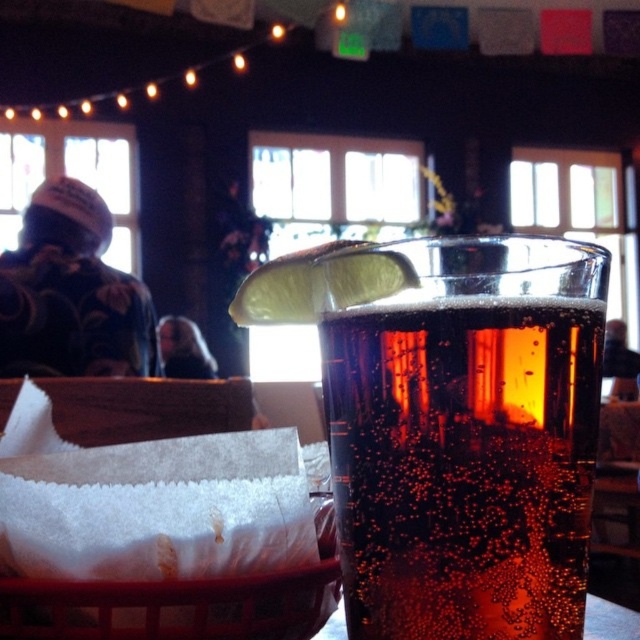
You are a bartender who needs to place a new drink order. The drink must be shorter than the dark hair at center. Can the amber glass at upper center hold this drink?

The amber glass at upper center is not as tall as the dark hair at center, so it can hold the drink.

You are a bartender preparing to place a new drink on the table. The table has limited space. Given the sizes of the amber glass at upper center and the wooden basket at lower left, which object takes up more space on the table?

The amber glass at upper center is bigger than the wooden basket at lower left, so it takes up more space on the table.